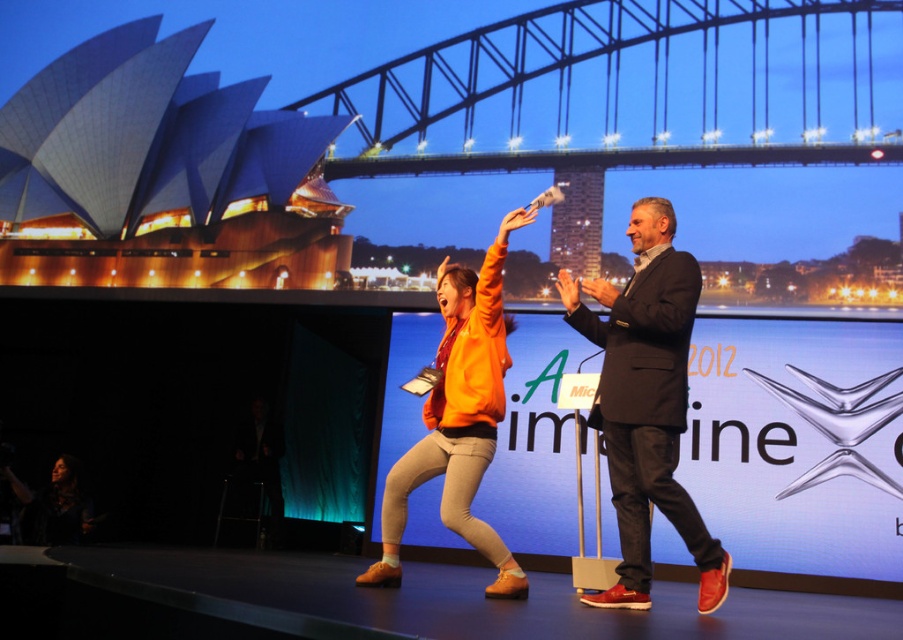
Question: Which of the following is the farthest from the observer?

Choices:
 (A) orange suede shoes at center
 (B) orange matte jacket at center
 (C) rubber-soled shoes at center
 (D) dark gray suit at center

Answer: (A)

Question: Among these objects, which one is farthest from the camera?

Choices:
 (A) orange matte jacket at center
 (B) orange suede shoes at center
 (C) rubber-soled shoes at center

Answer: (B)

Question: Is dark gray suit at center below velvet black dress at lower left?

Choices:
 (A) no
 (B) yes

Answer: (A)

Question: Is rubber-soled shoes at center to the right of dark gray suit at center from the viewer's perspective?

Choices:
 (A) no
 (B) yes

Answer: (A)

Question: Is orange matte jacket at center thinner than velvet black dress at lower left?

Choices:
 (A) yes
 (B) no

Answer: (B)

Question: Among these objects, which one is farthest from the camera?

Choices:
 (A) velvet black dress at lower left
 (B) orange matte jacket at center

Answer: (A)